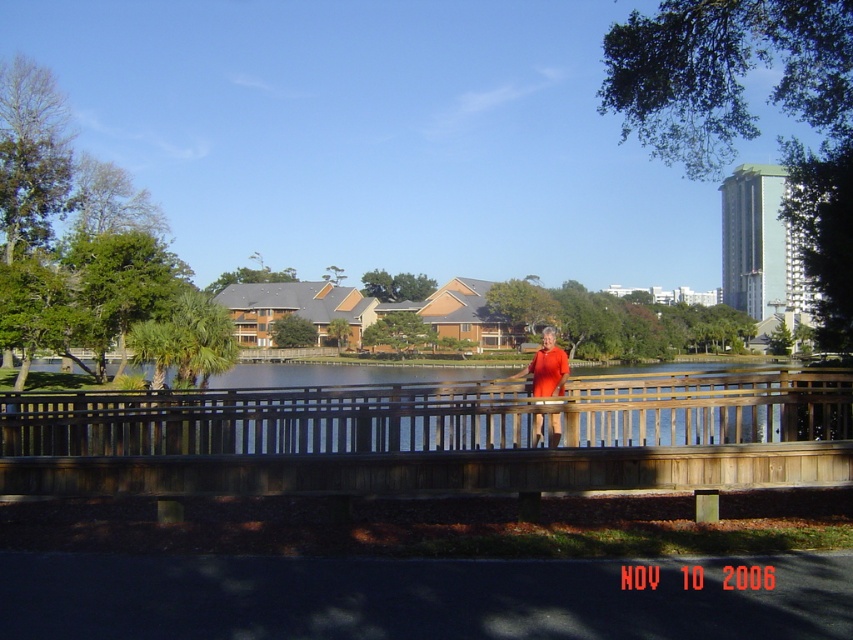
Question: Can you confirm if brown wooden bridge at center is wider than orange matte dress at center?

Choices:
 (A) yes
 (B) no

Answer: (A)

Question: In this image, where is brown wooden bridge at center located relative to orange matte dress at center?

Choices:
 (A) below
 (B) above

Answer: (A)

Question: Is brown wooden bridge at center above orange matte dress at center?

Choices:
 (A) yes
 (B) no

Answer: (B)

Question: Among these objects, which one is farthest from the camera?

Choices:
 (A) brown wooden bridge at center
 (B) orange matte dress at center

Answer: (B)

Question: Among these objects, which one is farthest from the camera?

Choices:
 (A) orange matte dress at center
 (B) brown wooden bridge at center

Answer: (A)